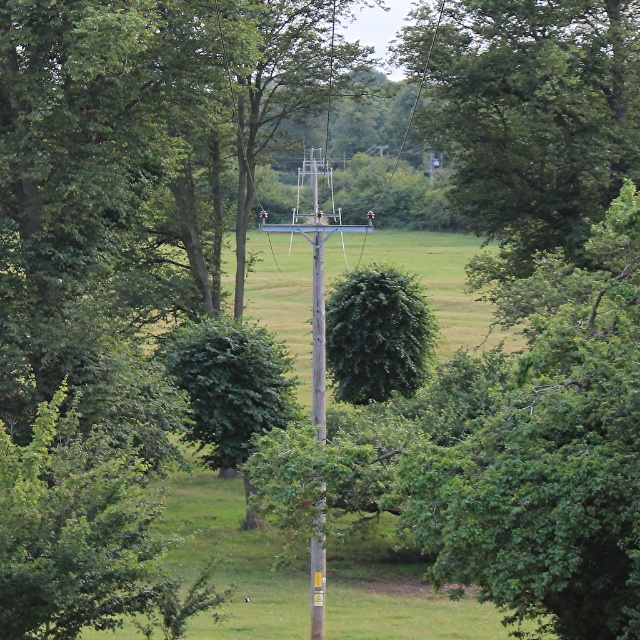
You are standing at the base of the wooden utility pole in the rural landscape. You notice a point marked at coordinates (531, 115). What object does this point correspond to?

The point at coordinates (531, 115) corresponds to the green leafy tree at center.

You are standing at the base of the wooden utility pole in the rural landscape. You want to walk directly towards the green leafy tree at center. Which direction should you head?

The green leafy tree at center is located at point [531,115], which means you should head towards the lower left direction from the utility pole to reach it.